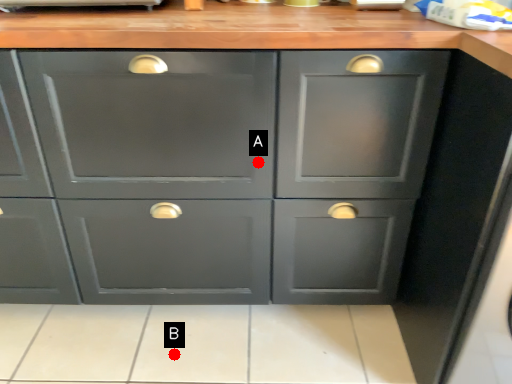
Question: Two points are circled on the image, labeled by A and B beside each circle. Which point is farther from the camera taking this photo?

Choices:
 (A) A is further
 (B) B is further

Answer: (B)